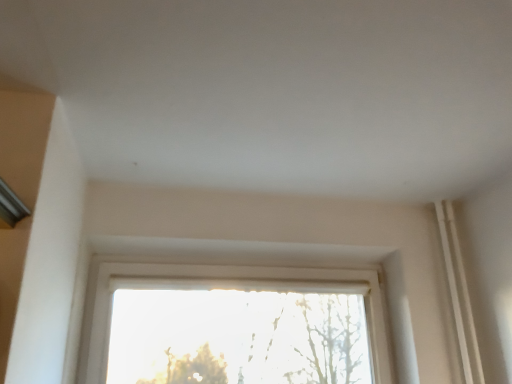
This screenshot has width=512, height=384. Describe the element at coordinates (222, 288) in the screenshot. I see `white plastic window at center` at that location.

Locate an element on the screen. This screenshot has width=512, height=384. white plastic window at center is located at coordinates (222, 288).

This screenshot has width=512, height=384. I want to click on white plastic window at center, so click(x=222, y=288).